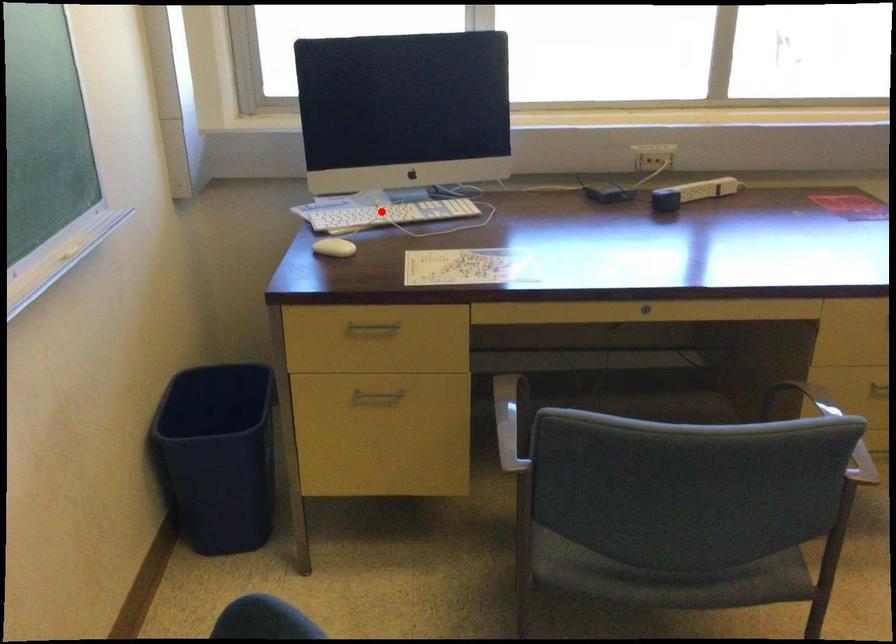
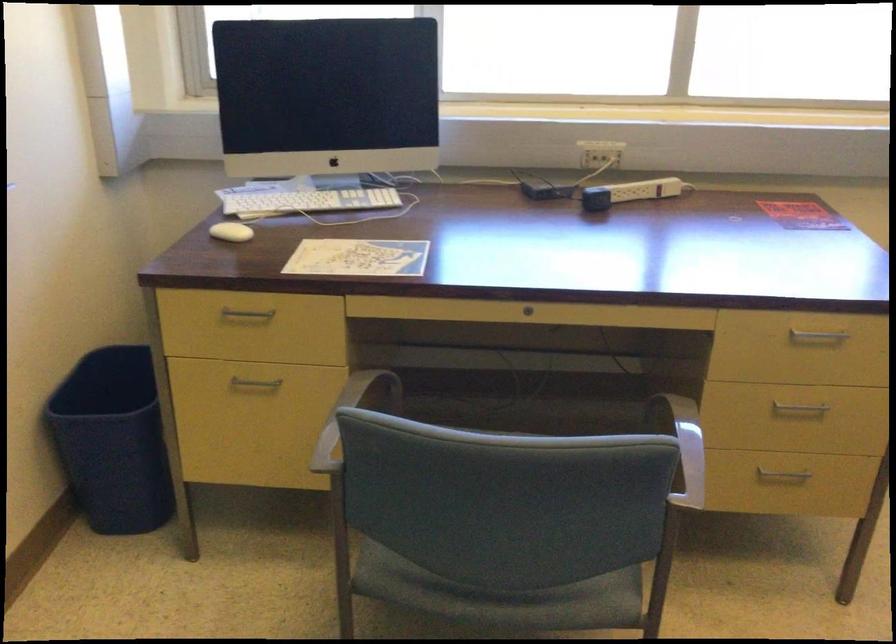
In the second image, find the point that corresponds to the highlighted location in the first image.

(304, 200)